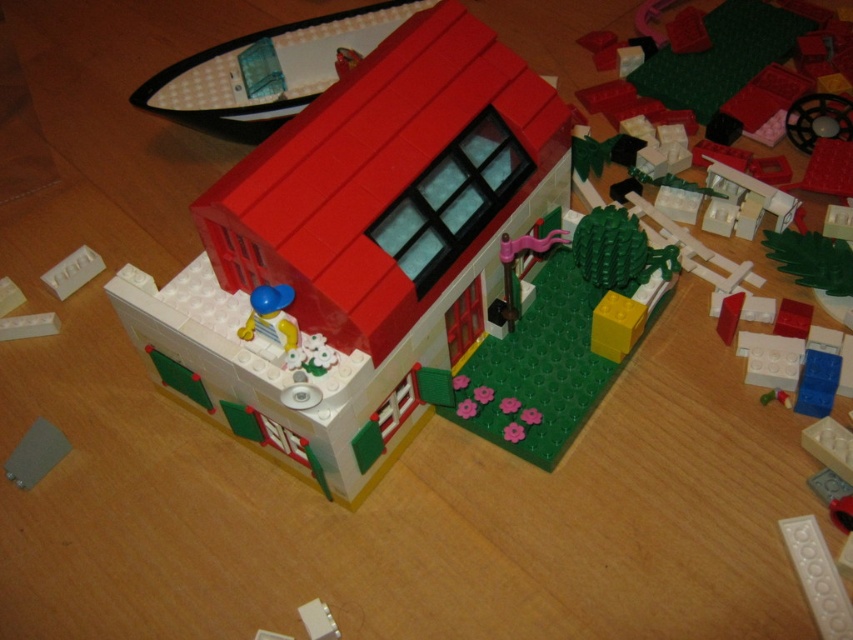
Does smooth plastic house at center appear on the left side of white matte brick at center?

In fact, smooth plastic house at center is to the right of white matte brick at center.

Between point (238, 369) and point (80, 260), which one is positioned behind?

Positioned behind is point (80, 260).

This screenshot has height=640, width=853. I want to click on smooth plastic house at center, so click(x=358, y=250).

Who is positioned more to the left, smooth plastic house at center or smooth gray plate at lower left?

smooth gray plate at lower left is more to the left.

Is point (450, 36) closer to viewer compared to point (30, 461)?

Yes, it is.

This screenshot has height=640, width=853. In order to click on smooth plastic house at center in this screenshot , I will do `click(358, 250)`.

The image size is (853, 640). Describe the element at coordinates (35, 452) in the screenshot. I see `smooth gray plate at lower left` at that location.

Is smooth gray plate at lower left below white matte brick at center?

Yes, smooth gray plate at lower left is below white matte brick at center.

Where is `smooth gray plate at lower left`? Image resolution: width=853 pixels, height=640 pixels. smooth gray plate at lower left is located at coordinates (35, 452).

The height and width of the screenshot is (640, 853). In order to click on smooth gray plate at lower left in this screenshot , I will do `click(35, 452)`.